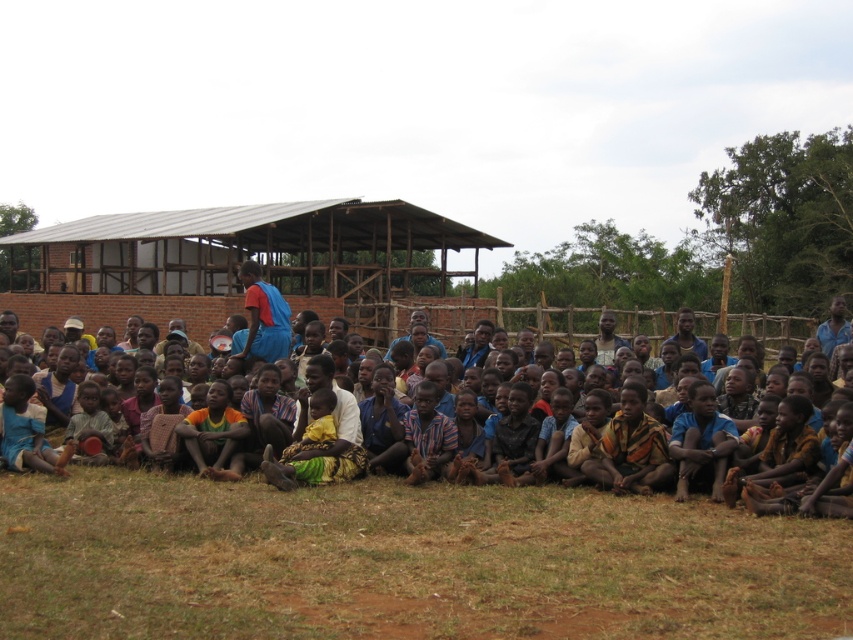
Question: Estimate the real-world distances between objects in this image. Which object is closer to the brown textured cloth at center?

Choices:
 (A) brown brick hut at center
 (B) blue fabric shirt at center

Answer: (A)

Question: Can you confirm if brown brick hut at center is positioned above brown textured cloth at center?

Choices:
 (A) yes
 (B) no

Answer: (A)

Question: Is brown brick hut at center wider than blue fabric shirt at center?

Choices:
 (A) no
 (B) yes

Answer: (B)

Question: Among these objects, which one is farthest from the camera?

Choices:
 (A) blue fabric shirt at center
 (B) brown brick hut at center

Answer: (B)

Question: Which point is closer to the camera?

Choices:
 (A) (143, 300)
 (B) (280, 304)

Answer: (B)

Question: Does brown textured cloth at center appear over blue fabric shirt at center?

Choices:
 (A) yes
 (B) no

Answer: (B)